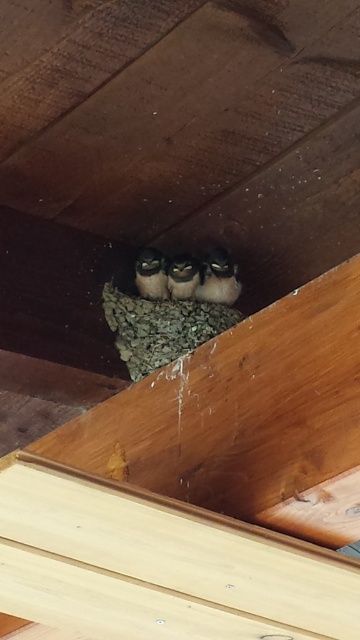
Question: Which of these objects is positioned closest to the brown fuzzy nest at center?

Choices:
 (A) gray mud nest at center
 (B) brown fuzzy owl at center

Answer: (B)

Question: Considering the real-world distances, which object is farthest from the gray mud nest at center?

Choices:
 (A) brown fuzzy nest at center
 (B) brown fuzzy bird at center
 (C) brown fuzzy owl at center

Answer: (B)

Question: Can you confirm if brown fuzzy bird at center is positioned above brown fuzzy nest at center?

Choices:
 (A) yes
 (B) no

Answer: (B)

Question: Is brown fuzzy bird at center wider than brown fuzzy nest at center?

Choices:
 (A) no
 (B) yes

Answer: (B)

Question: Which of the following is the closest to the observer?

Choices:
 (A) brown fuzzy nest at center
 (B) brown fuzzy owl at center
 (C) gray mud nest at center

Answer: (C)

Question: Does gray mud nest at center come in front of brown fuzzy nest at center?

Choices:
 (A) yes
 (B) no

Answer: (A)